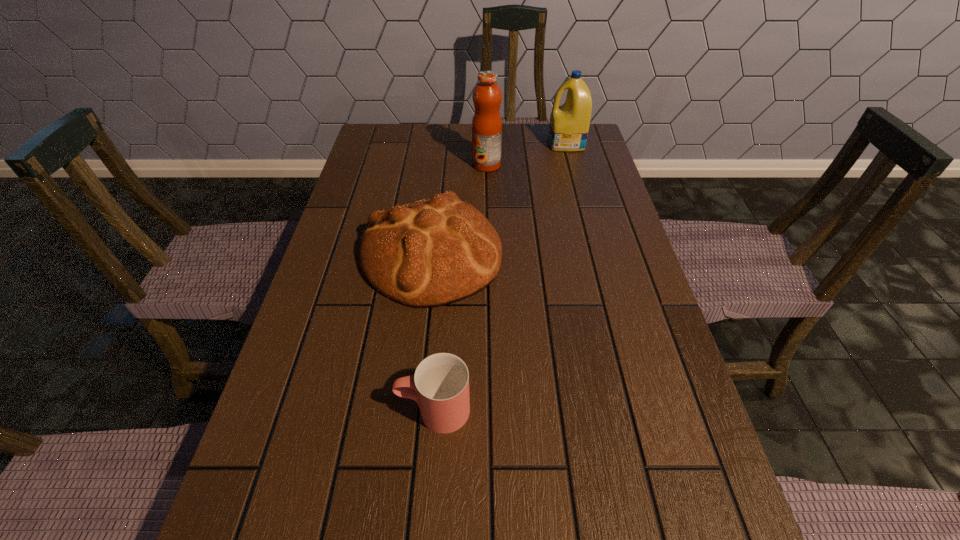
Image resolution: width=960 pixels, height=540 pixels. Identify the location of object present at the far right corner. (569, 124).

Where is `vacant space at the far edge of the desktop`? The height and width of the screenshot is (540, 960). vacant space at the far edge of the desktop is located at coordinates (540, 145).

This screenshot has height=540, width=960. In the image, there is a desktop. Identify the location of free space at the left edge. (288, 483).

The image size is (960, 540). I want to click on vacant space at the right edge of the desktop, so click(x=688, y=539).

In the image, there is a desktop. Where is `free space at the far right corner`? This screenshot has height=540, width=960. free space at the far right corner is located at coordinates (567, 152).

The image size is (960, 540). In order to click on vacant area that lies between the farthest object and the cup in this screenshot , I will do `click(500, 276)`.

At what (x,y) coordinates should I click in order to perform the action: click on vacant point located between the detergent and the second nearest object. Please return your answer as a coordinate pair (x, y). The height and width of the screenshot is (540, 960). Looking at the image, I should click on (498, 199).

At what (x,y) coordinates should I click in order to perform the action: click on free space between the cup and the third farthest object. Please return your answer as a coordinate pair (x, y). Looking at the image, I should click on [x=432, y=332].

This screenshot has height=540, width=960. I want to click on vacant area that lies between the cup and the third farthest object, so click(x=432, y=332).

Find the location of a particular element. vacant point located between the bread and the second tallest object is located at coordinates (498, 199).